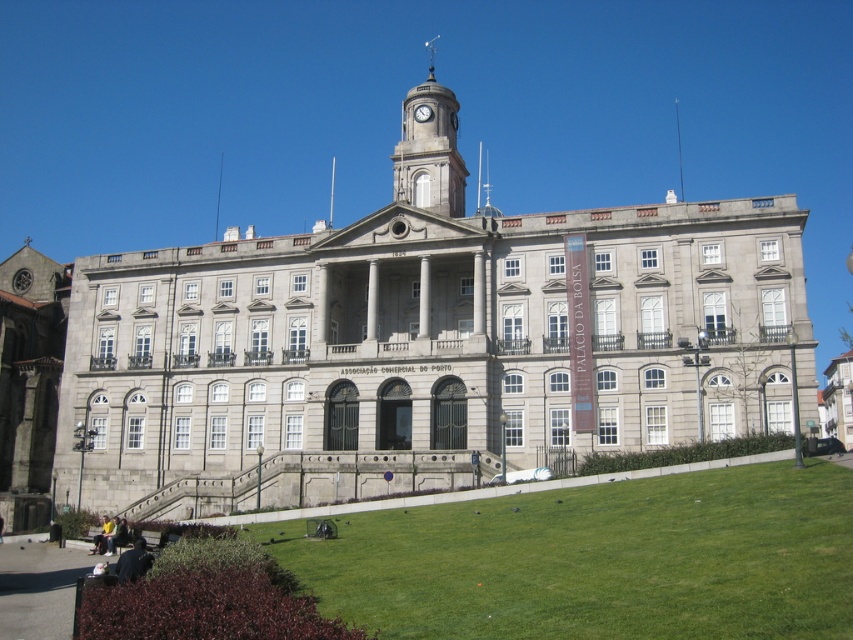
Measure the distance between point (x=592, y=506) and camera.

Point (x=592, y=506) is 46.01 meters away from camera.

Can you confirm if green grass at lower center is positioned above smooth gray clock tower at upper center?

Actually, green grass at lower center is below smooth gray clock tower at upper center.

Is point (538, 493) positioned before point (456, 216)?

Yes, point (538, 493) is in front of point (456, 216).

This screenshot has height=640, width=853. Find the location of `green grass at lower center`. green grass at lower center is located at coordinates (596, 560).

Does smooth gray clock tower at upper center appear on the right side of white glossy clock at center?

In fact, smooth gray clock tower at upper center is to the left of white glossy clock at center.

Who is lower down, smooth gray clock tower at upper center or white glossy clock at center?

white glossy clock at center is lower down.

Which is in front, point (409, 120) or point (425, 118)?

Positioned in front is point (425, 118).

This screenshot has width=853, height=640. What are the coordinates of `smooth gray clock tower at upper center` in the screenshot? It's located at (428, 148).

Which of these two, green grass at lower center or white glossy clock at center, stands taller?

green grass at lower center

Which is in front, point (426, 573) or point (416, 118)?

Point (426, 573) is more forward.

What do you see at coordinates (596, 560) in the screenshot? The image size is (853, 640). I see `green grass at lower center` at bounding box center [596, 560].

Locate an element on the screen. The image size is (853, 640). green grass at lower center is located at coordinates (596, 560).